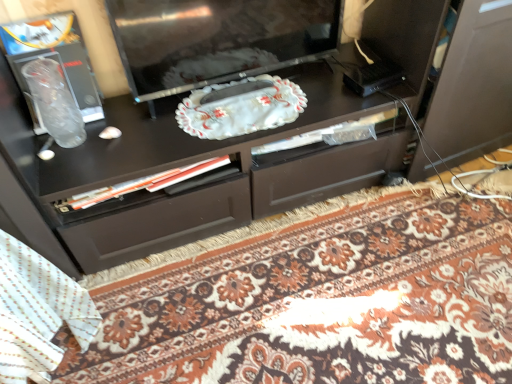
Question: Can you confirm if glossy black television at center is wider than floral carpet at center?

Choices:
 (A) yes
 (B) no

Answer: (B)

Question: From the image's perspective, would you say glossy black television at center is positioned over floral carpet at center?

Choices:
 (A) yes
 (B) no

Answer: (A)

Question: Can you confirm if glossy black television at center is taller than floral carpet at center?

Choices:
 (A) yes
 (B) no

Answer: (A)

Question: Is glossy black television at center outside of floral carpet at center?

Choices:
 (A) no
 (B) yes

Answer: (B)

Question: Is glossy black television at center bigger than floral carpet at center?

Choices:
 (A) yes
 (B) no

Answer: (B)

Question: Is glossy black television at center positioned with its back to floral carpet at center?

Choices:
 (A) yes
 (B) no

Answer: (B)

Question: Can you confirm if white textured blanket at lower left is positioned to the right of floral carpet at center?

Choices:
 (A) yes
 (B) no

Answer: (B)

Question: Is white textured blanket at lower left facing away from floral carpet at center?

Choices:
 (A) no
 (B) yes

Answer: (A)

Question: Does white textured blanket at lower left lie behind floral carpet at center?

Choices:
 (A) yes
 (B) no

Answer: (B)

Question: From the image's perspective, is white textured blanket at lower left beneath floral carpet at center?

Choices:
 (A) no
 (B) yes

Answer: (A)

Question: Are white textured blanket at lower left and floral carpet at center located far from each other?

Choices:
 (A) no
 (B) yes

Answer: (A)

Question: From a real-world perspective, is white textured blanket at lower left over floral carpet at center?

Choices:
 (A) yes
 (B) no

Answer: (A)

Question: Would you say floral carpet at center is a long distance from glossy black television at center?

Choices:
 (A) yes
 (B) no

Answer: (B)